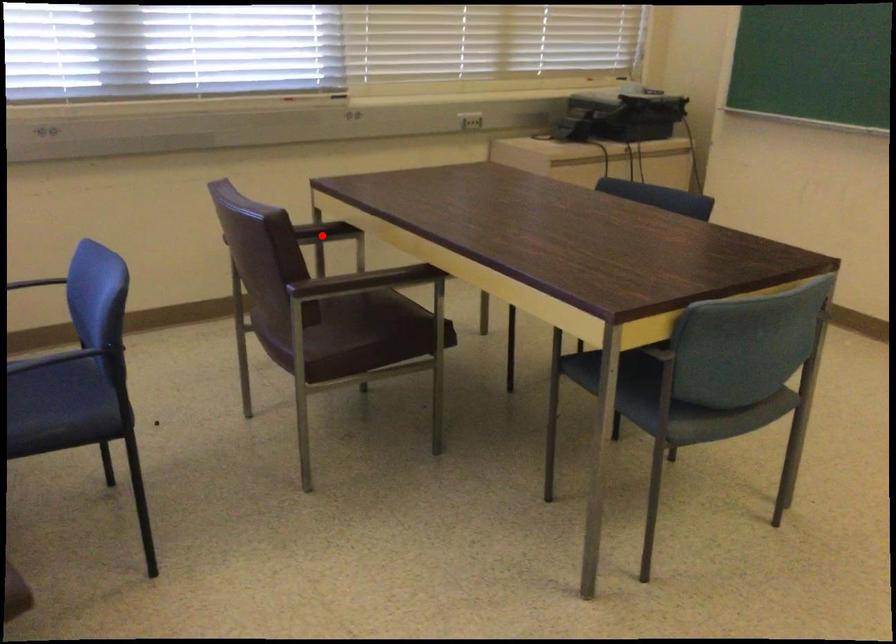
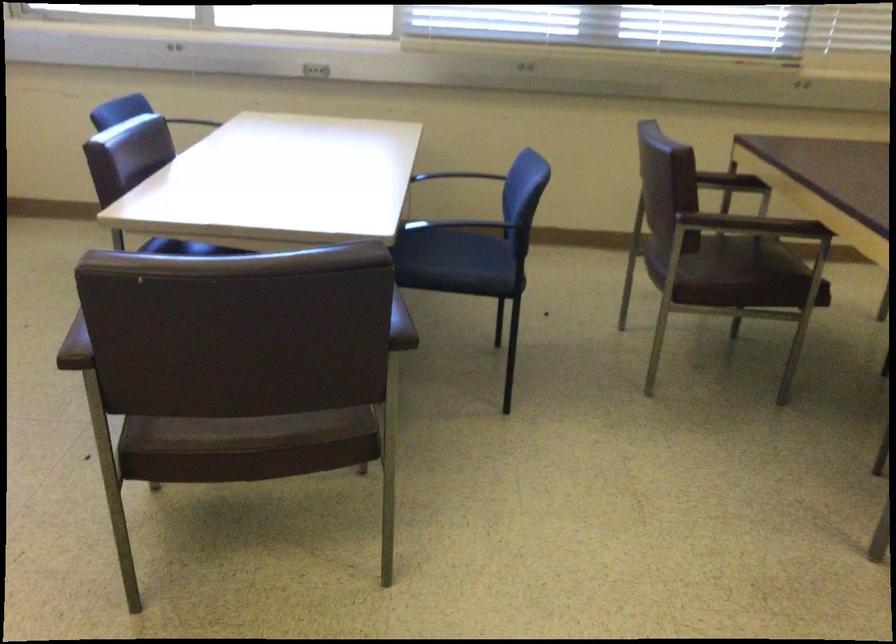
The point at the highlighted location is marked in the first image. Where is the corresponding point in the second image?

(730, 182)